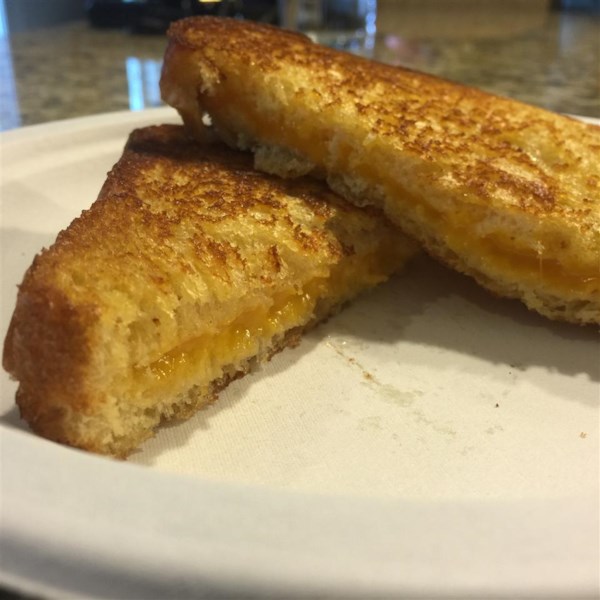
This screenshot has width=600, height=600. In order to click on plate in this screenshot , I will do `click(368, 458)`.